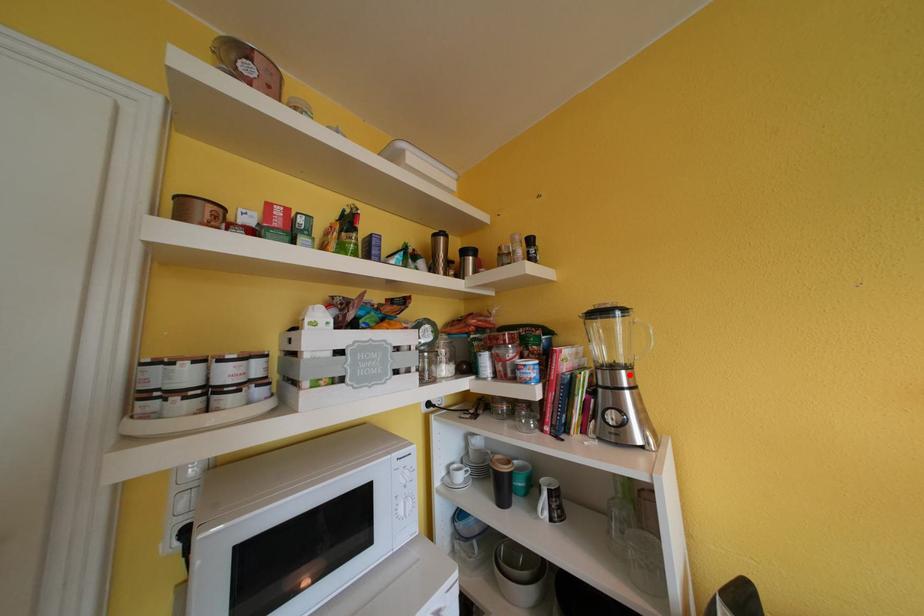
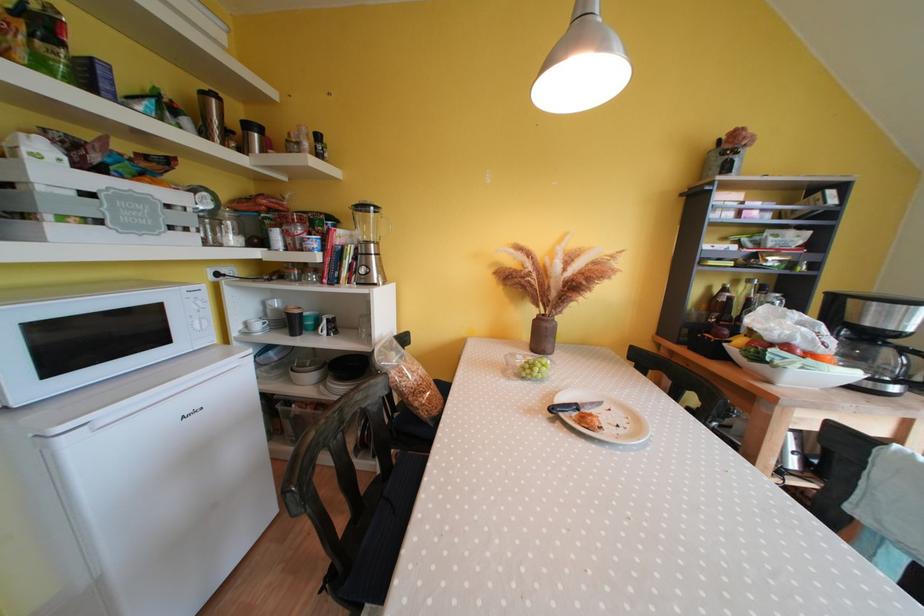
In the second image, find the point that corresponds to the highlighted location in the first image.

(379, 249)